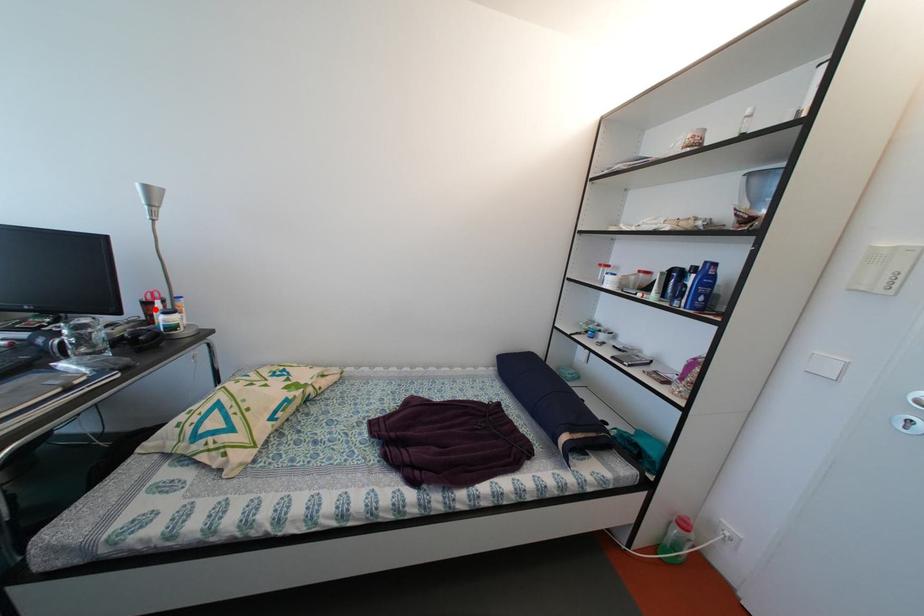
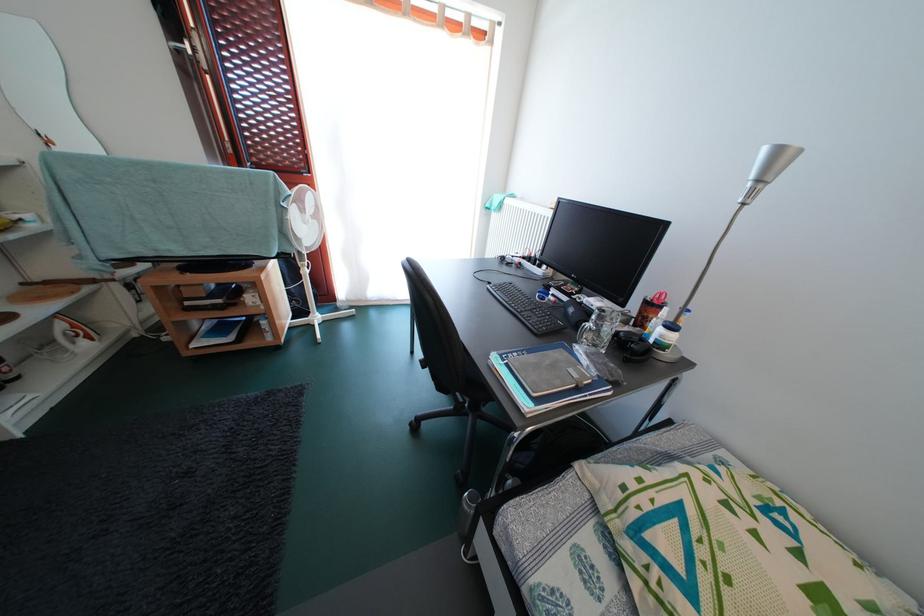
The point at the highlighted location is marked in the first image. Where is the corresponding point in the second image?

(658, 310)